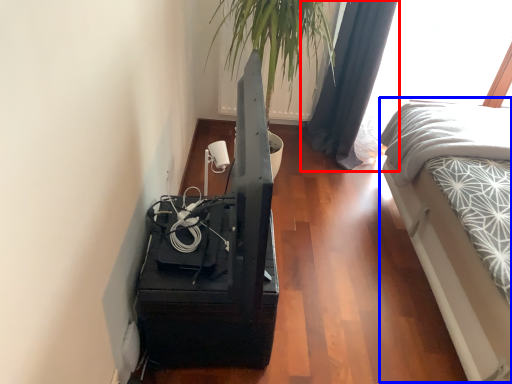
Question: Which of the following is the farthest to the observer, curtain (highlighted by a red box) or bed (highlighted by a blue box)?

Choices:
 (A) curtain
 (B) bed

Answer: (A)